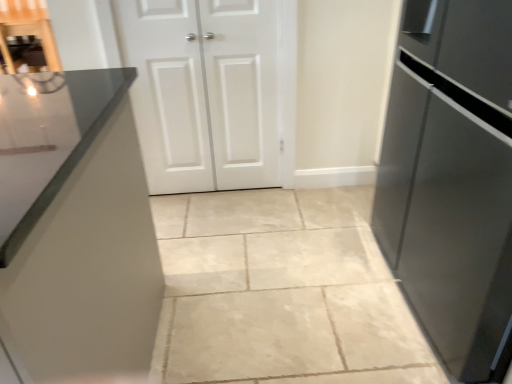
Question: Is satin black refrigerator at right located outside white matte cabinet doors at center, which is the 2th door in right-to-left order?

Choices:
 (A) no
 (B) yes

Answer: (B)

Question: Is satin black refrigerator at right bigger than white matte cabinet doors at center, marked as the first door in a left-to-right arrangement?

Choices:
 (A) no
 (B) yes

Answer: (B)

Question: Is satin black refrigerator at right facing towards white matte cabinet doors at center, which is the 2th door in right-to-left order?

Choices:
 (A) no
 (B) yes

Answer: (A)

Question: Is satin black refrigerator at right beside white matte cabinet doors at center, which is the 2th door in right-to-left order?

Choices:
 (A) no
 (B) yes

Answer: (A)

Question: Is white matte cabinet doors at center, marked as the first door in a left-to-right arrangement, at the back of satin black refrigerator at right?

Choices:
 (A) yes
 (B) no

Answer: (B)

Question: Looking at the image, does white matte cabinet doors at center, marked as the first door in a left-to-right arrangement, seem bigger or smaller compared to satin black refrigerator at right?

Choices:
 (A) big
 (B) small

Answer: (B)

Question: Is point (180, 13) closer or farther from the camera than point (500, 306)?

Choices:
 (A) closer
 (B) farther

Answer: (B)

Question: In the image, is white matte cabinet doors at center, which is the 2th door in right-to-left order, on the left side or the right side of satin black refrigerator at right?

Choices:
 (A) left
 (B) right

Answer: (A)

Question: Is white matte cabinet doors at center, marked as the first door in a left-to-right arrangement, wider or thinner than satin black refrigerator at right?

Choices:
 (A) thin
 (B) wide

Answer: (A)

Question: From their relative heights in the image, would you say white matte cabinet doors at center, which is the 2th door in right-to-left order, is taller or shorter than white matte door at center, acting as the first door starting from the right?

Choices:
 (A) short
 (B) tall

Answer: (B)

Question: In the image, is white matte cabinet doors at center, marked as the first door in a left-to-right arrangement, positioned in front of or behind white matte door at center, the second door viewed from the left?

Choices:
 (A) behind
 (B) front

Answer: (B)

Question: Considering the positions of white matte cabinet doors at center, marked as the first door in a left-to-right arrangement, and white matte door at center, the second door viewed from the left, in the image, is white matte cabinet doors at center, marked as the first door in a left-to-right arrangement, bigger or smaller than white matte door at center, the second door viewed from the left,?

Choices:
 (A) big
 (B) small

Answer: (A)

Question: From a real-world perspective, is white matte cabinet doors at center, which is the 2th door in right-to-left order, positioned above or below white matte door at center, acting as the first door starting from the right?

Choices:
 (A) below
 (B) above

Answer: (A)

Question: Is point (495, 344) closer or farther from the camera than point (159, 11)?

Choices:
 (A) farther
 (B) closer

Answer: (B)

Question: In terms of width, does satin black refrigerator at right look wider or thinner when compared to white matte cabinet doors at center, which is the 2th door in right-to-left order?

Choices:
 (A) wide
 (B) thin

Answer: (A)